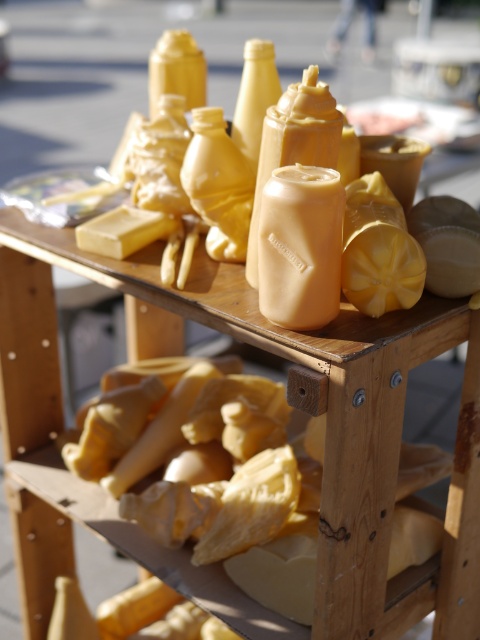
Question: Is matte yellow cheese at center smaller than yellow wax block at center?

Choices:
 (A) yes
 (B) no

Answer: (B)

Question: Among these points, which one is nearest to the camera?

Choices:
 (A) (365, 515)
 (B) (99, 253)

Answer: (A)

Question: Which point is farther to the camera?

Choices:
 (A) matte yellow cheese at center
 (B) yellow wax block at center

Answer: (B)

Question: Does matte yellow cheese at center come behind yellow wax block at center?

Choices:
 (A) yes
 (B) no

Answer: (B)

Question: Among these objects, which one is nearest to the camera?

Choices:
 (A) matte yellow cheese at center
 (B) yellow wax block at center

Answer: (A)

Question: Can you confirm if matte yellow cheese at center is wider than yellow wax block at center?

Choices:
 (A) no
 (B) yes

Answer: (B)